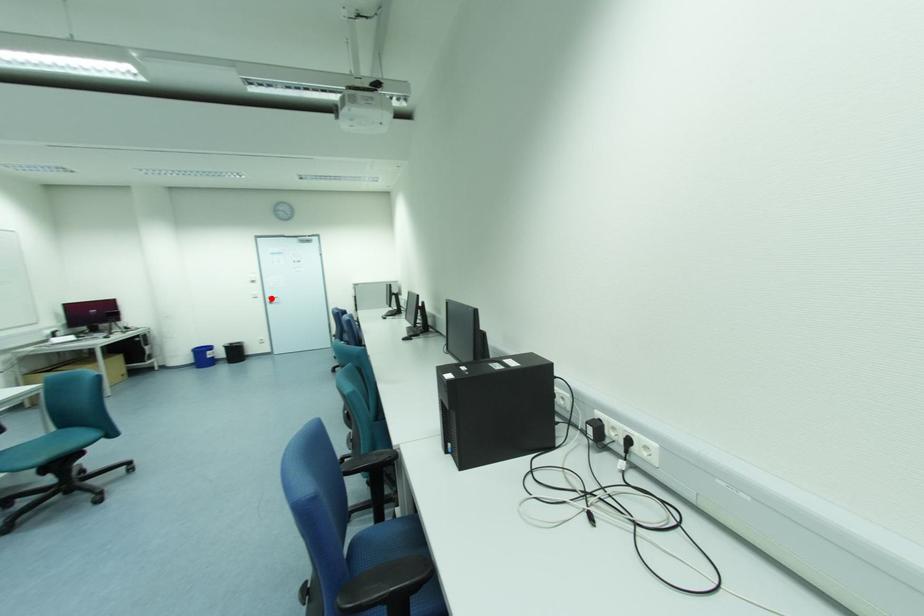
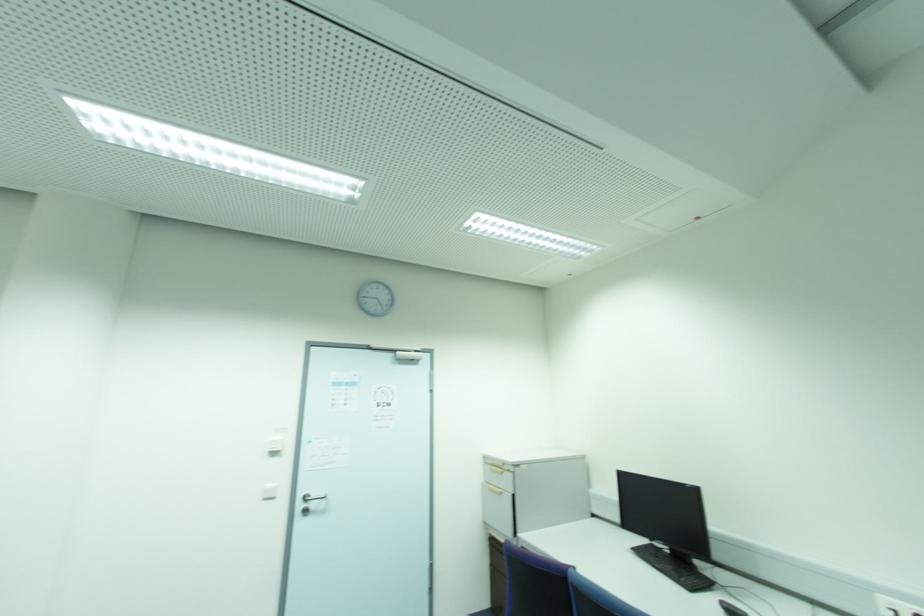
Locate, in the second image, the point that corresponds to the highlighted location in the first image.

(306, 500)